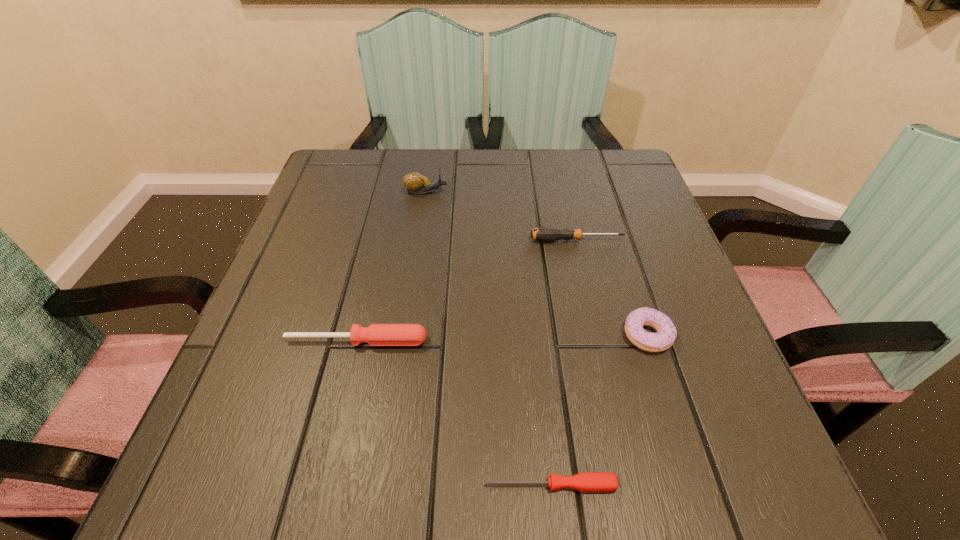
Image resolution: width=960 pixels, height=540 pixels. I want to click on vacant space located on the back of the farthest screwdriver, so click(x=560, y=166).

You are a GUI agent. You are given a task and a screenshot of the screen. Output one action in this format:
    pyautogui.click(x=<x>, y=<y>)
    Task: Click on the vacant space situated 0.280m at the tip of the nearest screwdriver
    
    Given the screenshot: What is the action you would take?
    pyautogui.click(x=275, y=485)

What are the coordinates of `vacant region located 0.230m at the tip of the nearest screwdriver` in the screenshot? It's located at (313, 485).

Identify the location of vacant area located at the tip of the nearest screwdriver. (343, 485).

This screenshot has height=540, width=960. I want to click on object that is at the far edge, so click(x=415, y=183).

At what (x,y) coordinates should I click in order to perform the action: click on object that is at the near edge. Please return your answer as a coordinate pair (x, y). Looking at the image, I should click on (593, 482).

Identify the location of object situated at the left edge. (376, 334).

Image resolution: width=960 pixels, height=540 pixels. I want to click on doughnut present at the right edge, so click(666, 334).

You are a GUI agent. You are given a task and a screenshot of the screen. Output one action in this format:
    pyautogui.click(x=<x>, y=<y>)
    Task: Click on the screwdriver positioned at the right edge
    
    Given the screenshot: What is the action you would take?
    pyautogui.click(x=546, y=234)

The height and width of the screenshot is (540, 960). Find the location of `vacant position at the far edge of the desktop`. vacant position at the far edge of the desktop is located at coordinates (538, 169).